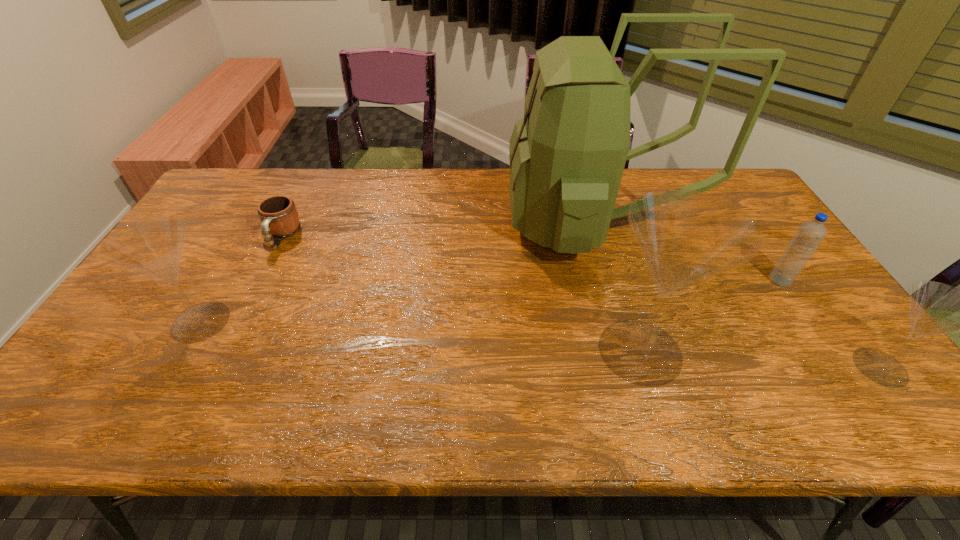
The image size is (960, 540). Find the location of `free space located on the left of the second tallest flute glass`. free space located on the left of the second tallest flute glass is located at coordinates (137, 322).

The image size is (960, 540). What are the coordinates of `free region located on the back of the fifth shortest object` in the screenshot? It's located at [603, 231].

Image resolution: width=960 pixels, height=540 pixels. In order to click on vacant space situated on the back of the shortest flute glass in this screenshot , I will do `click(847, 322)`.

Locate an element on the screen. Image resolution: width=960 pixels, height=540 pixels. vacant point located on the side of the shortest object with the handle is located at coordinates (240, 321).

Where is `vacant space located on the front pocket of the tallest object`? vacant space located on the front pocket of the tallest object is located at coordinates (432, 224).

Identify the location of vacant area located on the front pocket of the tallest object. The height and width of the screenshot is (540, 960). (388, 224).

At what (x,y) coordinates should I click in order to perform the action: click on free spot located on the front pocket of the tallest object. Please return your answer as a coordinate pair (x, y). This screenshot has width=960, height=540. Looking at the image, I should click on (469, 224).

Where is `free location located 0.070m on the left of the third farthest object`? The width and height of the screenshot is (960, 540). free location located 0.070m on the left of the third farthest object is located at coordinates (744, 280).

Find the location of `object that is at the far edge`. object that is at the far edge is located at coordinates (567, 155).

Locate an element on the screen. This screenshot has width=960, height=540. object at the left edge is located at coordinates (153, 246).